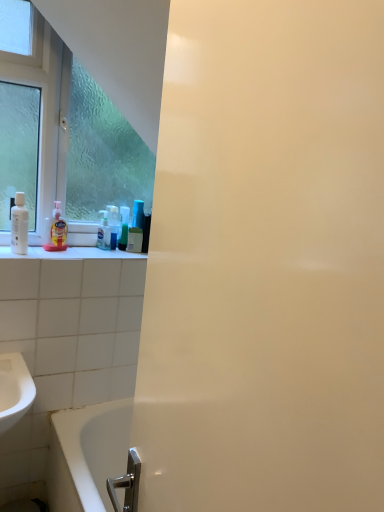
Question: Is translucent plastic soap dispenser at left, placed as the 2th cleaning product when sorted from right to left, positioned beyond the bounds of clear glass window at upper left?

Choices:
 (A) yes
 (B) no

Answer: (A)

Question: Does translucent plastic soap dispenser at left, the 2th cleaning product viewed from the back, appear on the left side of clear glass window at upper left?

Choices:
 (A) no
 (B) yes

Answer: (B)

Question: Would you say translucent plastic soap dispenser at left, placed as the 2th cleaning product when sorted from right to left, contains clear glass window at upper left?

Choices:
 (A) no
 (B) yes

Answer: (A)

Question: Is translucent plastic soap dispenser at left, placed as the 2th cleaning product when sorted from right to left, shorter than clear glass window at upper left?

Choices:
 (A) no
 (B) yes

Answer: (B)

Question: Does translucent plastic soap dispenser at left, placed as the 2th cleaning product when sorted from right to left, have a greater height compared to clear glass window at upper left?

Choices:
 (A) no
 (B) yes

Answer: (A)

Question: Considering the relative sizes of translucent plastic soap dispenser at left, placed as the 2th cleaning product when sorted from right to left, and clear glass window at upper left in the image provided, is translucent plastic soap dispenser at left, placed as the 2th cleaning product when sorted from right to left, thinner than clear glass window at upper left?

Choices:
 (A) no
 (B) yes

Answer: (B)

Question: Considering the relative sizes of white glossy bottle at left, the second mouthwash from the right, and clear glass window at upper left in the image provided, is white glossy bottle at left, the second mouthwash from the right, bigger than clear glass window at upper left?

Choices:
 (A) yes
 (B) no

Answer: (B)

Question: From the image's perspective, is white glossy bottle at left, arranged as the first mouthwash when viewed from the front, located beneath clear glass window at upper left?

Choices:
 (A) no
 (B) yes

Answer: (B)

Question: Can you confirm if white glossy bottle at left, which is the 2th mouthwash from back to front, is positioned to the right of clear glass window at upper left?

Choices:
 (A) no
 (B) yes

Answer: (A)

Question: Could you tell me if white glossy bottle at left, the second mouthwash from the right, is turned towards clear glass window at upper left?

Choices:
 (A) yes
 (B) no

Answer: (B)

Question: Is white glossy bottle at left, the second mouthwash from the right, not inside clear glass window at upper left?

Choices:
 (A) no
 (B) yes

Answer: (B)

Question: Considering the relative sizes of white glossy bottle at left, arranged as the first mouthwash when viewed from the front, and clear glass window at upper left in the image provided, is white glossy bottle at left, arranged as the first mouthwash when viewed from the front, taller than clear glass window at upper left?

Choices:
 (A) yes
 (B) no

Answer: (B)

Question: From a real-world perspective, is translucent plastic mouthwash at center, which is the 1th mouthwash in right-to-left order, physically below white glossy bottle at left, the second mouthwash from the right?

Choices:
 (A) yes
 (B) no

Answer: (A)